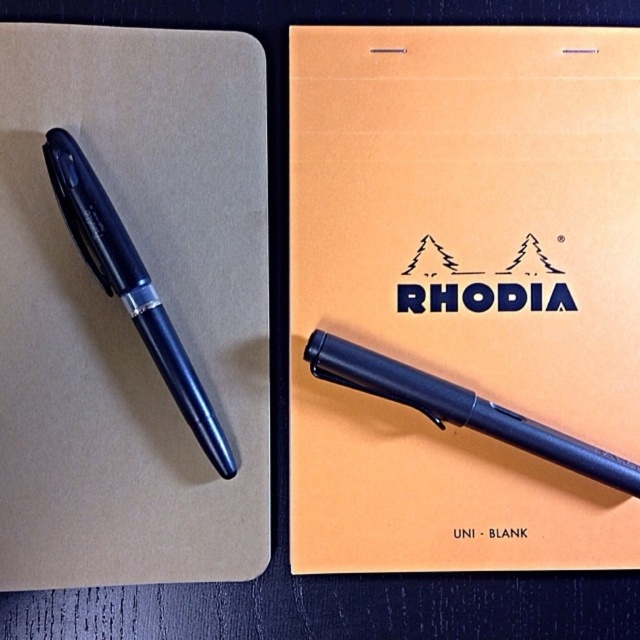
Between point (58, 193) and point (464, 419), which one is positioned in front?

Point (58, 193)

Can you confirm if matte black pen at left is thinner than matte black pen at center?

Indeed, matte black pen at left has a lesser width compared to matte black pen at center.

Describe the element at coordinates (131, 285) in the screenshot. The width and height of the screenshot is (640, 640). I see `matte black pen at left` at that location.

I want to click on matte black pen at left, so click(x=131, y=285).

Which of these two, matte brown notepad at left or matte black pen at left, stands shorter?

Standing shorter between the two is matte black pen at left.

Which of these two, matte brown notepad at left or matte black pen at left, stands taller?

matte brown notepad at left is taller.

You are a GUI agent. You are given a task and a screenshot of the screen. Output one action in this format:
    pyautogui.click(x=<x>, y=<y>)
    Task: Click on the matte brown notepad at left
    This screenshot has height=640, width=640.
    Given the screenshot: What is the action you would take?
    pyautogui.click(x=125, y=314)

What do you see at coordinates (125, 314) in the screenshot?
I see `matte brown notepad at left` at bounding box center [125, 314].

Who is more forward, (x=144, y=356) or (x=358, y=346)?

Point (x=144, y=356) is more forward.

Find the location of a particular element. matte brown notepad at left is located at coordinates (125, 314).